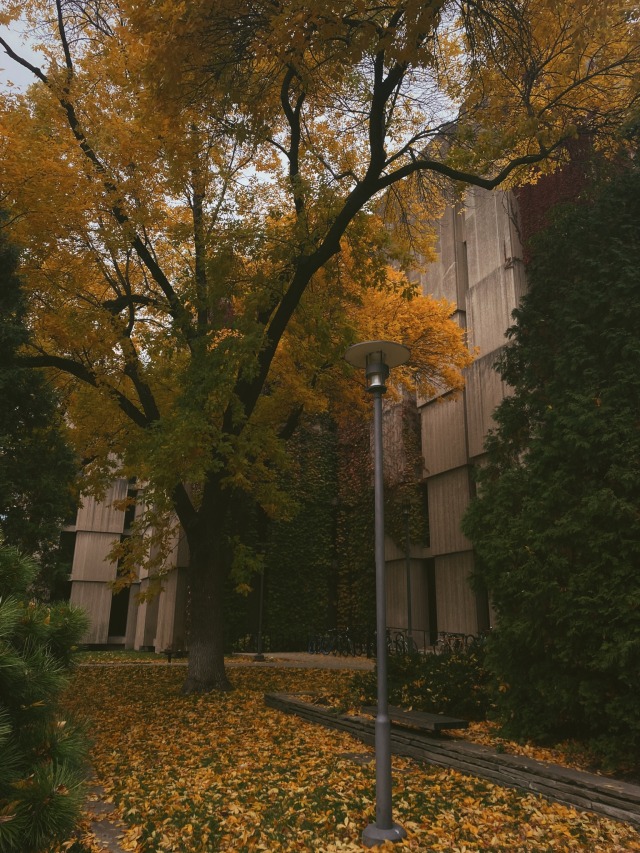
Locate an element on the screen. This screenshot has height=853, width=640. place to sit is located at coordinates (413, 715), (169, 652).